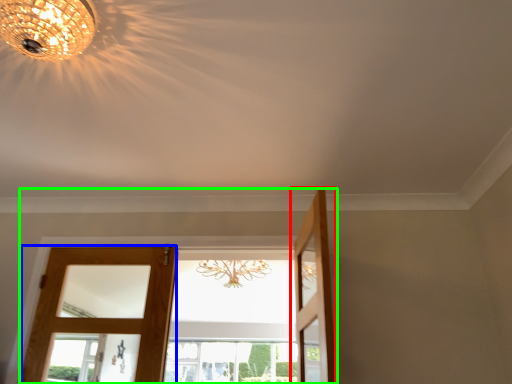
Question: Which is farther away from door (highlighted by a red box)? door (highlighted by a blue box) or door (highlighted by a green box)?

Choices:
 (A) door
 (B) door

Answer: (A)